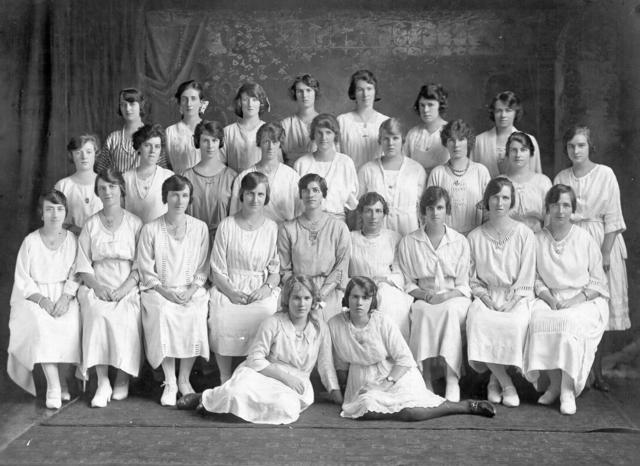
This screenshot has width=640, height=466. What are the coordinates of `rug` in the screenshot? It's located at [x=148, y=416].